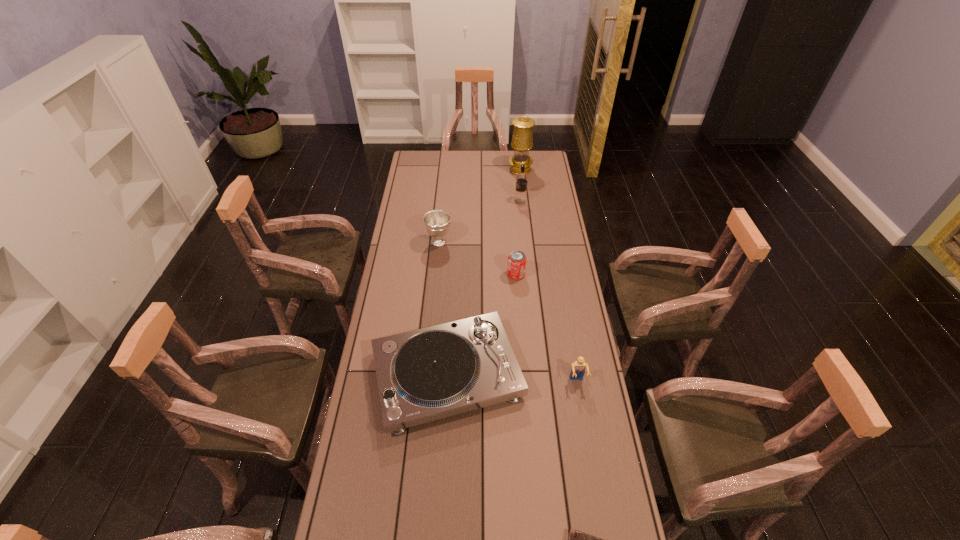
In order to click on oil lamp that is positioned at the right edge in this screenshot , I will do `click(522, 141)`.

At what (x,y) coordinates should I click in order to perform the action: click on Lego at the right edge. Please return your answer as a coordinate pair (x, y). Looking at the image, I should click on 578,369.

At what (x,y) coordinates should I click in order to perform the action: click on object that is at the far right corner. Please return your answer as a coordinate pair (x, y). Looking at the image, I should click on (522, 141).

Image resolution: width=960 pixels, height=540 pixels. Identify the location of free space at the left edge of the desktop. (335, 531).

Where is `vacant space at the right edge`? vacant space at the right edge is located at coordinates (553, 265).

The image size is (960, 540). In order to click on vacant space at the far right corner of the desktop in this screenshot , I will do `click(547, 158)`.

Locate an element on the screen. The height and width of the screenshot is (540, 960). free point between the farthest object and the third tallest object is located at coordinates (480, 206).

Locate an element on the screen. vacant point located between the second tallest object and the Lego is located at coordinates (548, 292).

Locate an element on the screen. This screenshot has height=540, width=960. free space that is in between the fourth farthest object and the fifth nearest object is located at coordinates (477, 258).

Where is `free spot between the vodka and the chalice`? free spot between the vodka and the chalice is located at coordinates point(480,222).